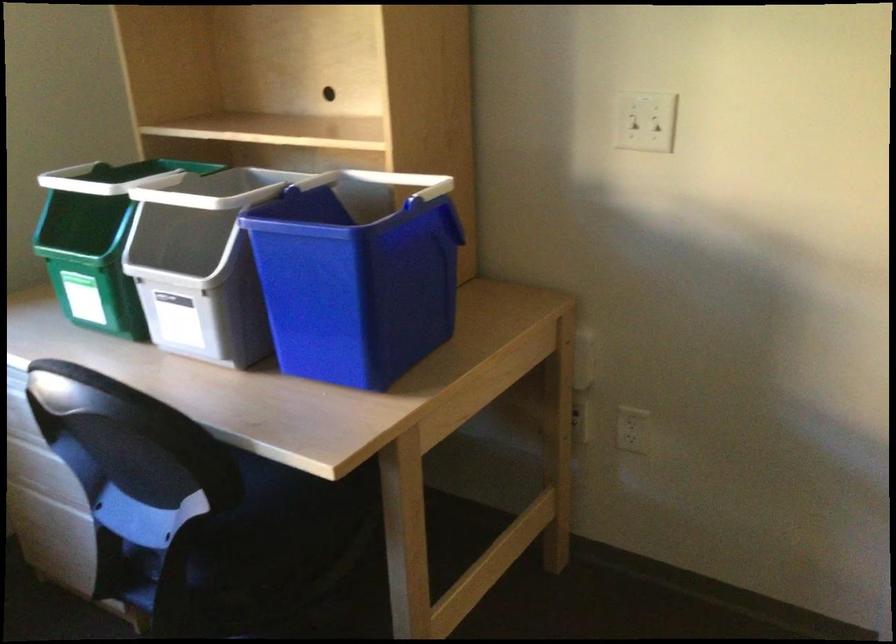
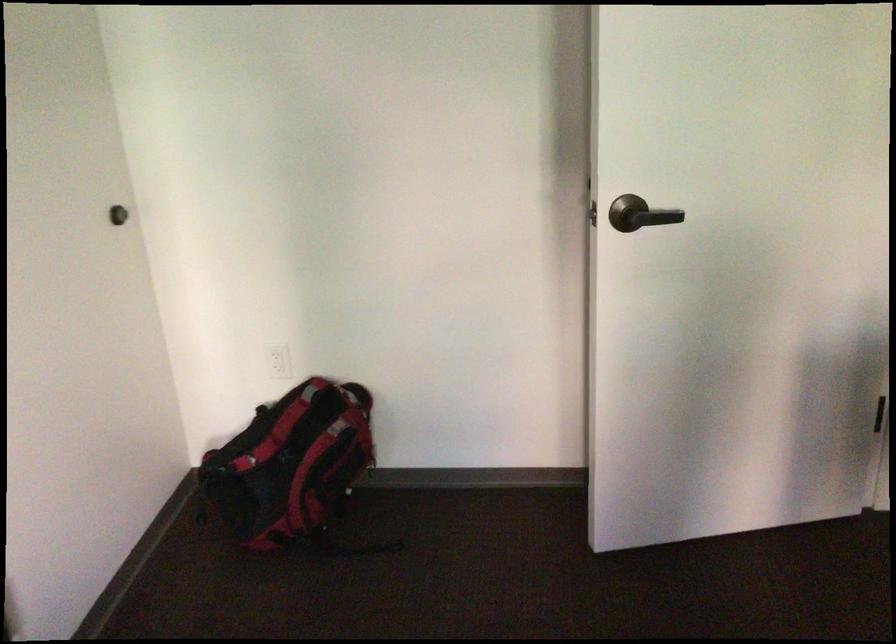
The images are taken continuously from a first-person perspective. In which direction is your viewpoint rotating?

The camera's rotation is toward right-down.